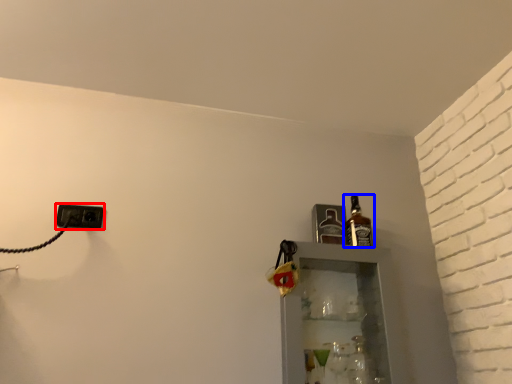
Question: Among these objects, which one is farthest to the camera, electric outlet (highlighted by a red box) or bottle (highlighted by a blue box)?

Choices:
 (A) electric outlet
 (B) bottle

Answer: (B)